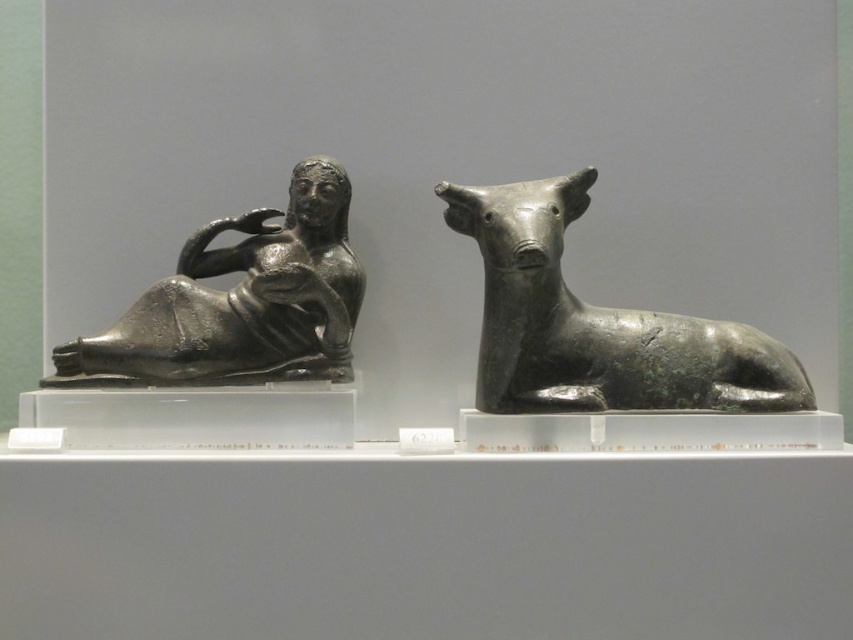
Describe the element at coordinates (596, 324) in the screenshot. I see `bronze bull at right` at that location.

How far apart are bronze bull at right and polished bronze reclining figure at left?

9.27 inches

Locate an element on the screen. The height and width of the screenshot is (640, 853). bronze bull at right is located at coordinates (596, 324).

Identify the location of bronze bull at right. (596, 324).